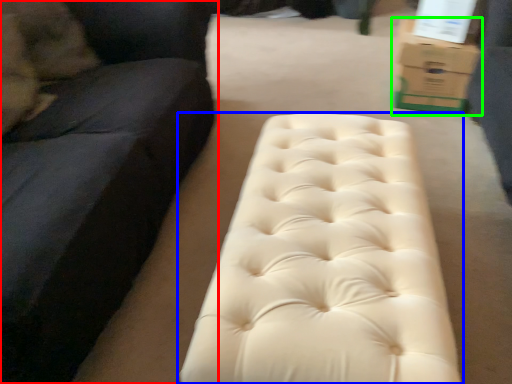
Question: Considering the real-world distances, which object is closest to studio couch (highlighted by a red box)? furniture (highlighted by a blue box) or cardboard box (highlighted by a green box).

Choices:
 (A) furniture
 (B) cardboard box

Answer: (A)